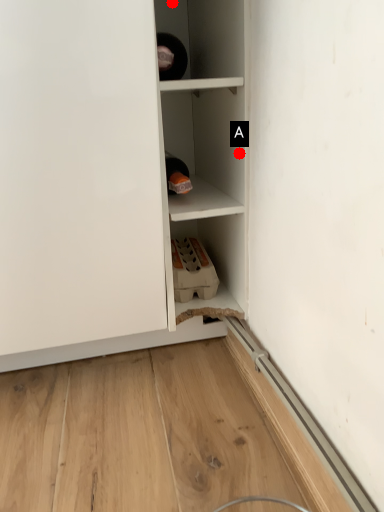
Question: Two points are circled on the image, labeled by A and B beside each circle. Which point is closer to the camera?

Choices:
 (A) A is closer
 (B) B is closer

Answer: (A)